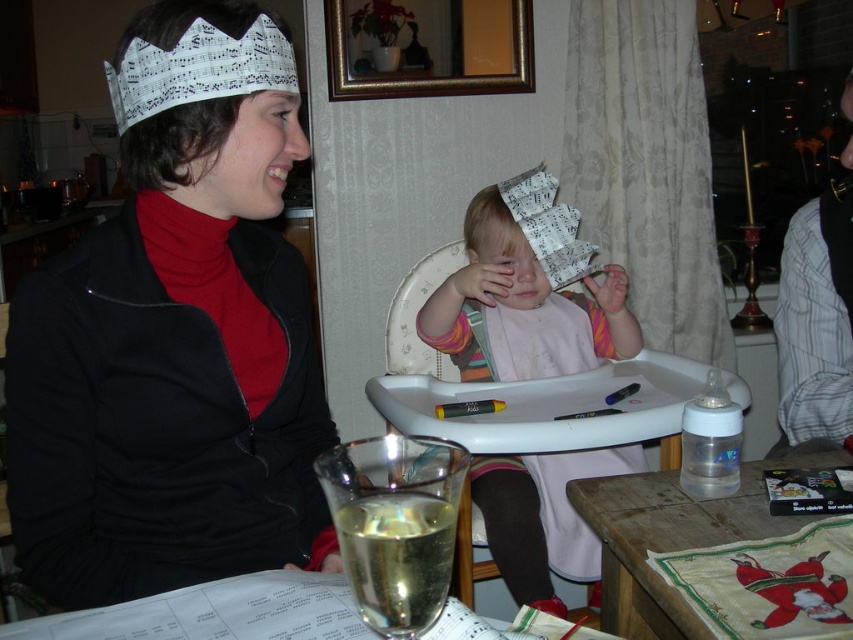
Question: Which object is the closest to the translucent glass at lower center?

Choices:
 (A) wooden table at center
 (B) wooden table at lower right
 (C) white paper crown at center
 (D) matte black jacket at upper left

Answer: (B)

Question: Is matte black jacket at upper left bigger than translucent glass at lower center?

Choices:
 (A) no
 (B) yes

Answer: (B)

Question: Is wooden table at center to the left of translucent glass at lower center from the viewer's perspective?

Choices:
 (A) no
 (B) yes

Answer: (A)

Question: Is wooden table at center wider than wooden table at lower right?

Choices:
 (A) no
 (B) yes

Answer: (B)

Question: Which object is the closest to the wooden table at lower right?

Choices:
 (A) wooden table at center
 (B) translucent glass at lower center
 (C) white paper crown at center

Answer: (A)

Question: Which point is closer to the camera taking this photo?

Choices:
 (A) (422, 557)
 (B) (161, 356)
 (C) (767, 522)
 (D) (677, 381)

Answer: (A)